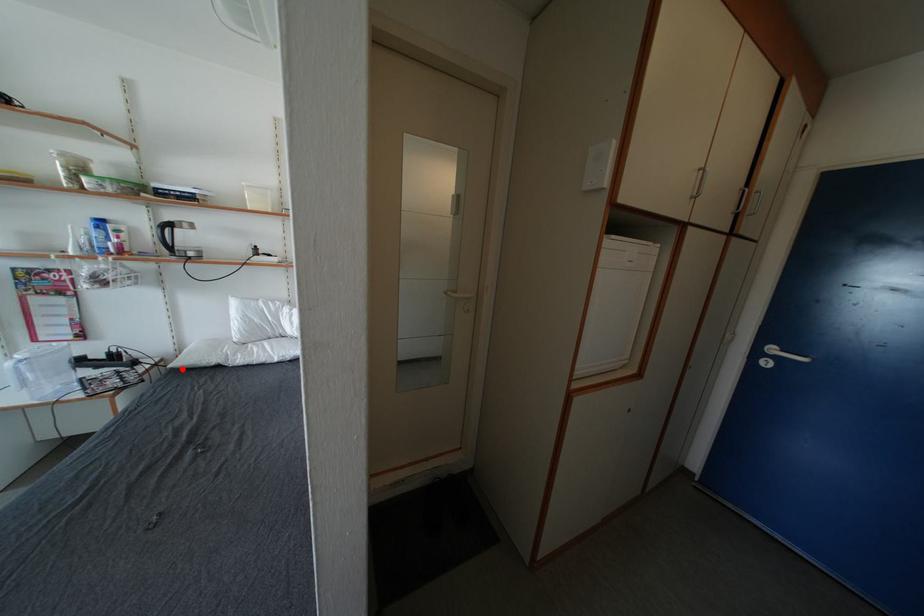
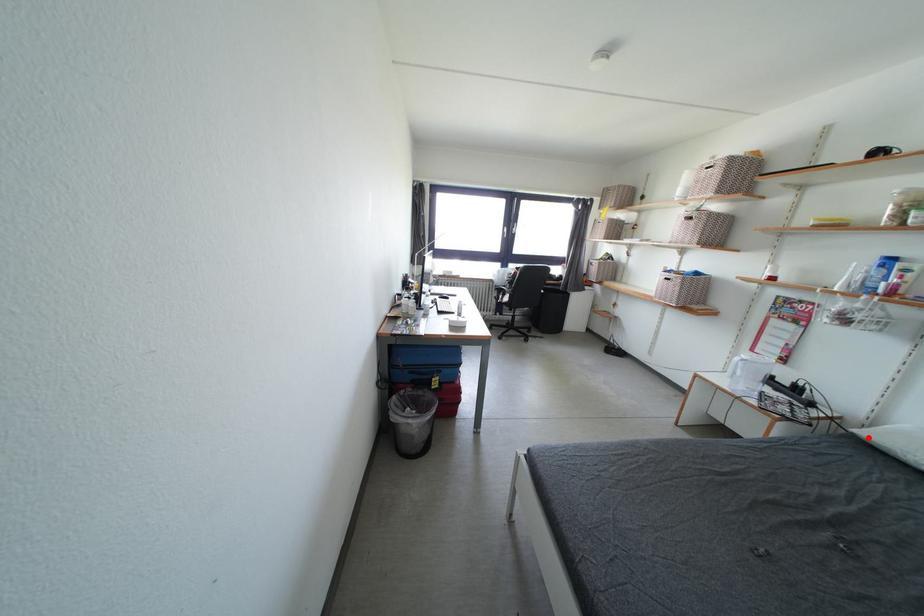
I am providing you with two images of the same scene from different viewpoints. A red point is marked on the first image and another point is marked on the second image. Is the red point in image1 aligned with the point shown in image2?

Yes